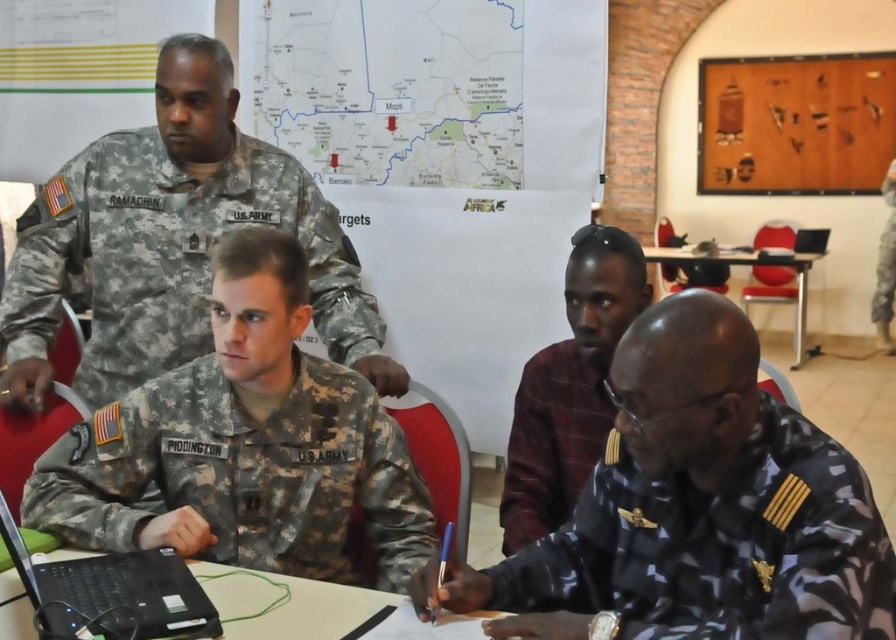
You are a military assistant who needs to place a 12 inch binder on the black plastic table at lower center. Can you safely place it between the camouflage fabric uniform at lower right and the edge of the table?

The distance between the camouflage fabric uniform at lower right and the black plastic table at lower center is 14.91 inches. Since the binder is 12 inches long, there is sufficient space to place it between the camouflage fabric uniform at lower right and the edge of the table.

You are a photographer who needs to capture a closeup shot of the camouflage fabric uniform at lower right and the black plastic table at lower center. Given that your camera can only focus on objects within a 1.2 meter width, will both items fit within the camera frame?

The camouflage fabric uniform at lower right is narrower than the black plastic table at lower center. Since the camera can focus on objects within 1.2 meters, and the total width of both items combined would exceed the camera frame, it is unlikely they will both fit. However, the exact feasibility depends on the individual widths of each item. Without specific measurements, we cannot confirm if their combined width stays within the limit.